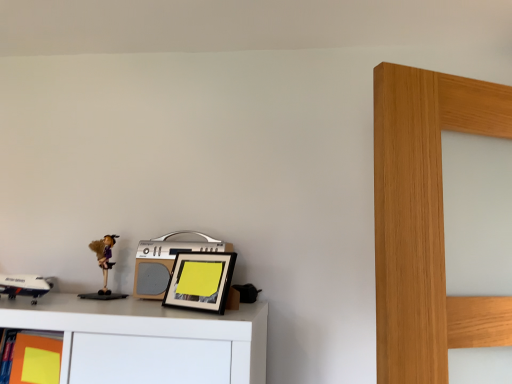
Question: Considering the relative sizes of matte yellow sticky note at lower left and matte purple doll at left in the image provided, is matte yellow sticky note at lower left taller than matte purple doll at left?

Choices:
 (A) no
 (B) yes

Answer: (B)

Question: Does matte yellow sticky note at lower left have a smaller size compared to matte purple doll at left?

Choices:
 (A) no
 (B) yes

Answer: (A)

Question: From a real-world perspective, is matte yellow sticky note at lower left beneath matte purple doll at left?

Choices:
 (A) yes
 (B) no

Answer: (A)

Question: Would you say matte purple doll at left is part of matte yellow sticky note at lower left's contents?

Choices:
 (A) yes
 (B) no

Answer: (B)

Question: Is matte yellow sticky note at lower left outside of matte purple doll at left?

Choices:
 (A) no
 (B) yes

Answer: (B)

Question: Is silver metallic stereo at center to the left or to the right of black matte picture frame at center in the image?

Choices:
 (A) left
 (B) right

Answer: (A)

Question: Considering the positions of silver metallic stereo at center and black matte picture frame at center in the image, is silver metallic stereo at center wider or thinner than black matte picture frame at center?

Choices:
 (A) wide
 (B) thin

Answer: (A)

Question: From a real-world perspective, relative to black matte picture frame at center, is silver metallic stereo at center vertically above or below?

Choices:
 (A) above
 (B) below

Answer: (A)

Question: From the image's perspective, is silver metallic stereo at center located above or below black matte picture frame at center?

Choices:
 (A) below
 (B) above

Answer: (B)

Question: Is point (169, 281) closer or farther from the camera than point (143, 248)?

Choices:
 (A) closer
 (B) farther

Answer: (A)

Question: Considering the positions of black matte picture frame at center and silver metallic stereo at center in the image, is black matte picture frame at center bigger or smaller than silver metallic stereo at center?

Choices:
 (A) big
 (B) small

Answer: (B)

Question: Considering their positions, is black matte picture frame at center located in front of or behind silver metallic stereo at center?

Choices:
 (A) front
 (B) behind

Answer: (A)

Question: From the image's perspective, relative to silver metallic stereo at center, is black matte picture frame at center above or below?

Choices:
 (A) above
 (B) below

Answer: (B)

Question: Is black matte picture frame at center bigger or smaller than matte yellow sticky note at lower left?

Choices:
 (A) big
 (B) small

Answer: (B)

Question: Would you say black matte picture frame at center is to the left or to the right of matte yellow sticky note at lower left in the picture?

Choices:
 (A) right
 (B) left

Answer: (A)